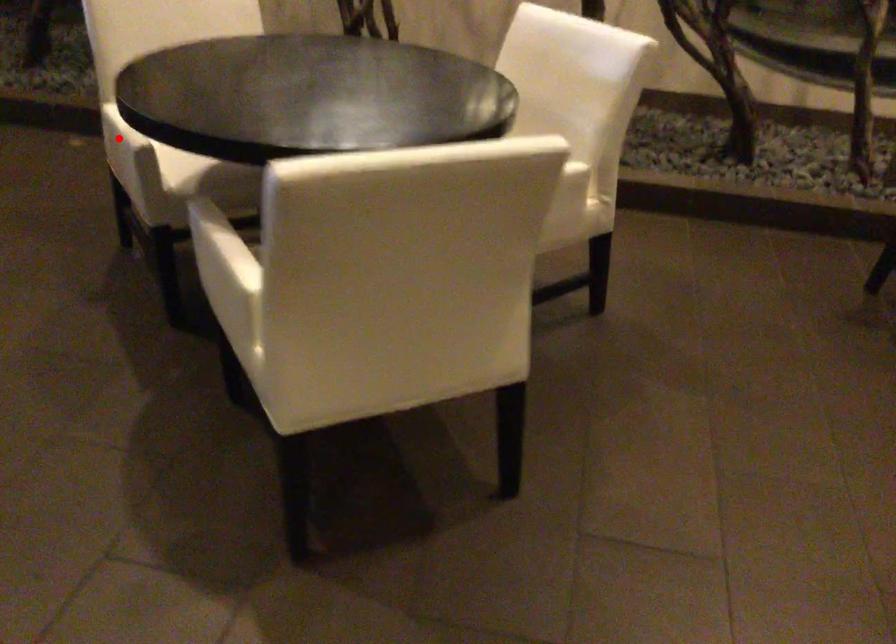
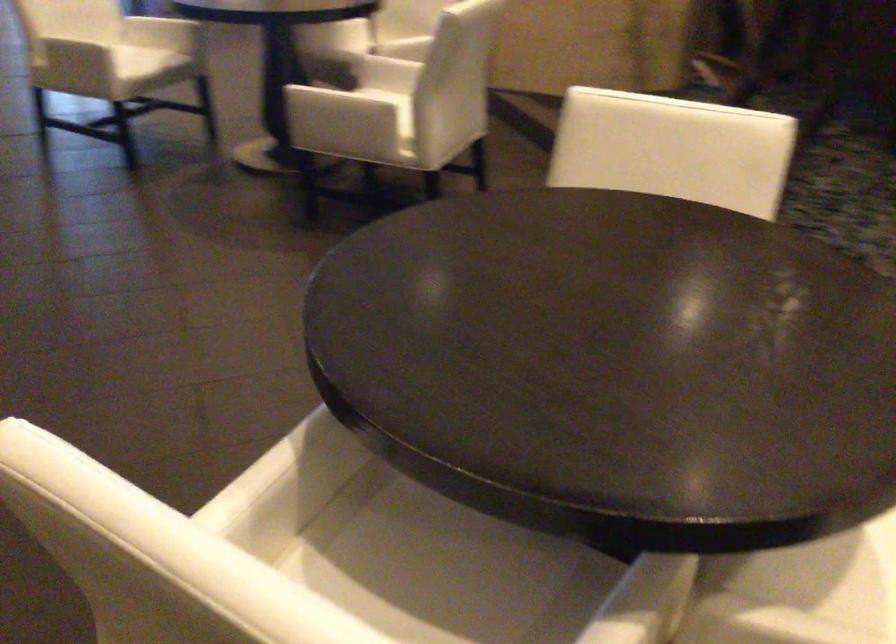
Question: I am providing you with two images of the same scene from different viewpoints. A red point is marked on the first image. At the location where the point appears in image 1, is it still visible in image 2?

Choices:
 (A) Yes
 (B) No

Answer: (B)